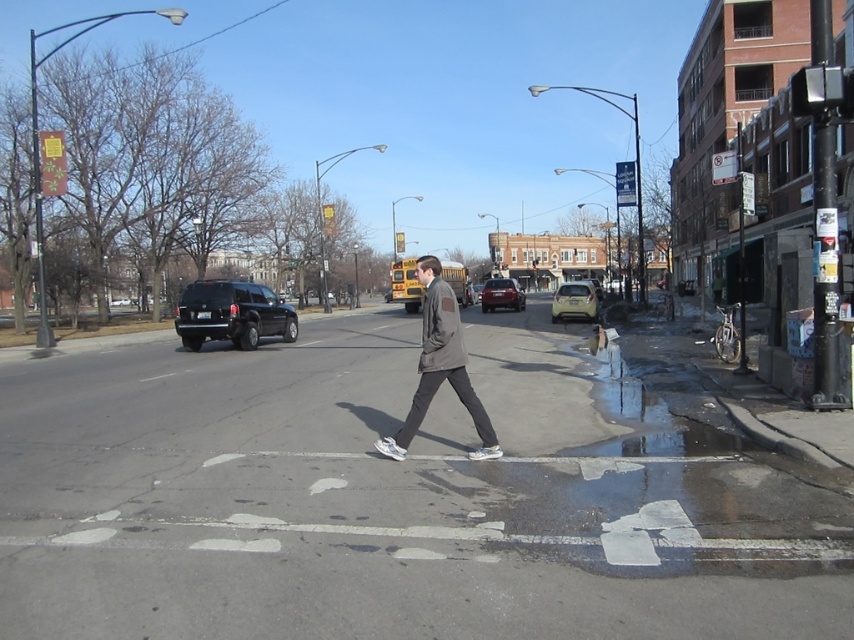
Is point (196, 340) more distant than point (492, 296)?

That is False.

Does shiny black suv at left have a greater width compared to matte red car at center?

No.

Find the location of a particular element. The width and height of the screenshot is (854, 640). shiny black suv at left is located at coordinates (232, 314).

What are the coordinates of `shiny black suv at left` in the screenshot? It's located at (232, 314).

Between matte gray crosswalk at center and shiny black suv at left, which one appears on the left side from the viewer's perspective?

Positioned to the left is shiny black suv at left.

Is matte gray crosswalk at center in front of shiny black suv at left?

Yes.

Which is in front, point (705, 620) or point (232, 282)?

Point (705, 620) is more forward.

Locate an element on the screen. matte gray crosswalk at center is located at coordinates (395, 499).

Which is above, metallic gold car at center or matte red car at center?

matte red car at center is above.

Where is `metallic gold car at center`? This screenshot has height=640, width=854. metallic gold car at center is located at coordinates (574, 301).

Does point (559, 317) lie in front of point (499, 291)?

Yes, point (559, 317) is closer to viewer.

This screenshot has width=854, height=640. Find the location of `metallic gold car at center`. metallic gold car at center is located at coordinates (574, 301).